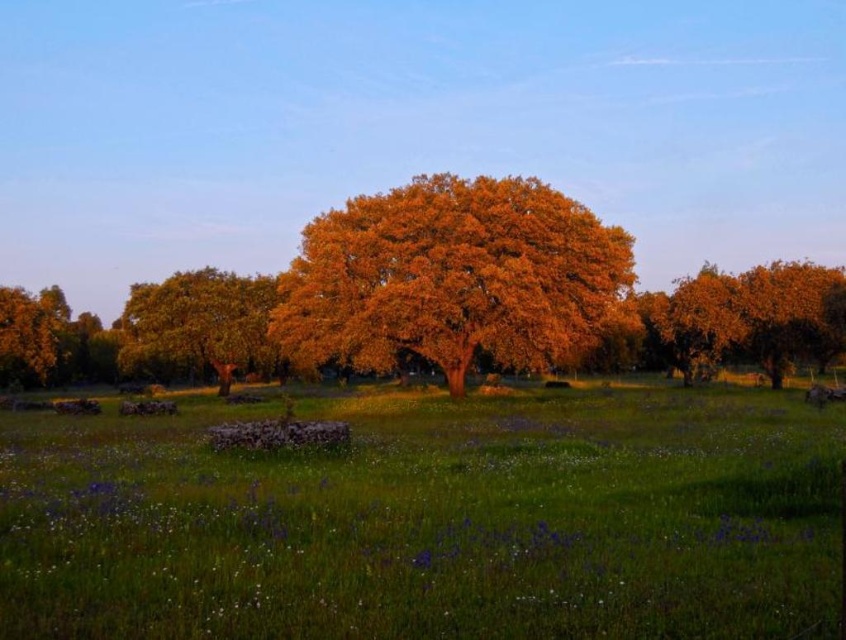
Between golden textured tree at center and golden textured tree at left, which one appears on the right side from the viewer's perspective?

From the viewer's perspective, golden textured tree at center appears more on the right side.

Locate an element on the screen. This screenshot has height=640, width=846. golden textured tree at center is located at coordinates (452, 278).

In order to click on golden textured tree at center in this screenshot , I will do `click(452, 278)`.

Which is above, green grassy field at center or golden textured tree at left?

golden textured tree at left is above.

Find the location of `green grassy field at center`. green grassy field at center is located at coordinates (431, 522).

Where is `green grassy field at center`? This screenshot has height=640, width=846. green grassy field at center is located at coordinates (431, 522).

Does green grassy field at center appear on the left side of golden textured tree at center?

Incorrect, green grassy field at center is not on the left side of golden textured tree at center.

Based on the photo, how much distance is there between green grassy field at center and golden textured tree at center?

14.88 meters

Is point (517, 540) in front of point (592, 275)?

Yes.

Find the location of a particular element. This screenshot has width=846, height=640. green grassy field at center is located at coordinates (431, 522).